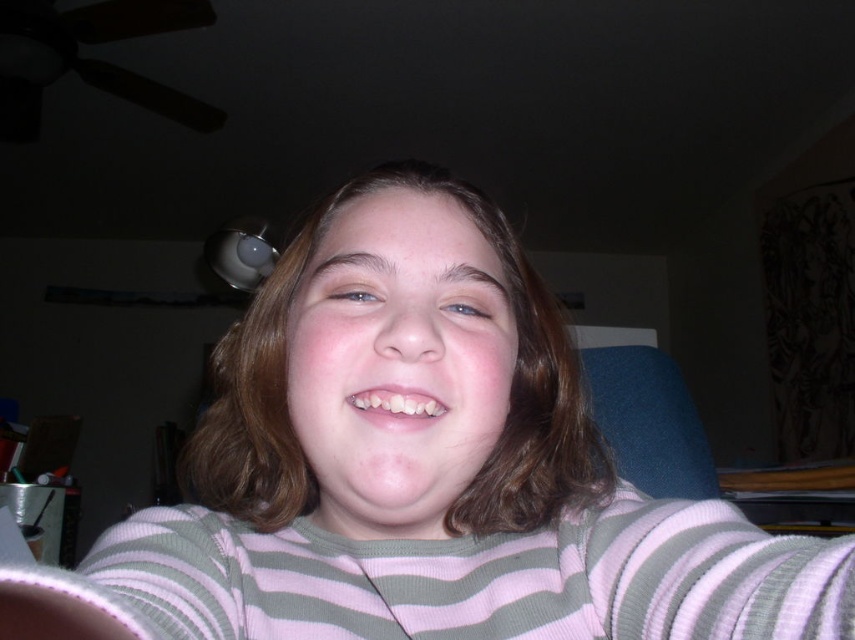
Question: Can you confirm if pink striped sweater at center is positioned below white glossy teeth at center?

Choices:
 (A) no
 (B) yes

Answer: (B)

Question: Observing the image, what is the correct spatial positioning of pink striped sweater at center in reference to white glossy teeth at center?

Choices:
 (A) below
 (B) above

Answer: (A)

Question: Among these points, which one is nearest to the camera?

Choices:
 (A) (186, 547)
 (B) (439, 401)

Answer: (B)

Question: Which of the following is the closest to the observer?

Choices:
 (A) (374, 419)
 (B) (266, 356)

Answer: (A)

Question: Observing the image, what is the correct spatial positioning of pink striped sweater at center in reference to white glossy teeth at center?

Choices:
 (A) left
 (B) right

Answer: (A)